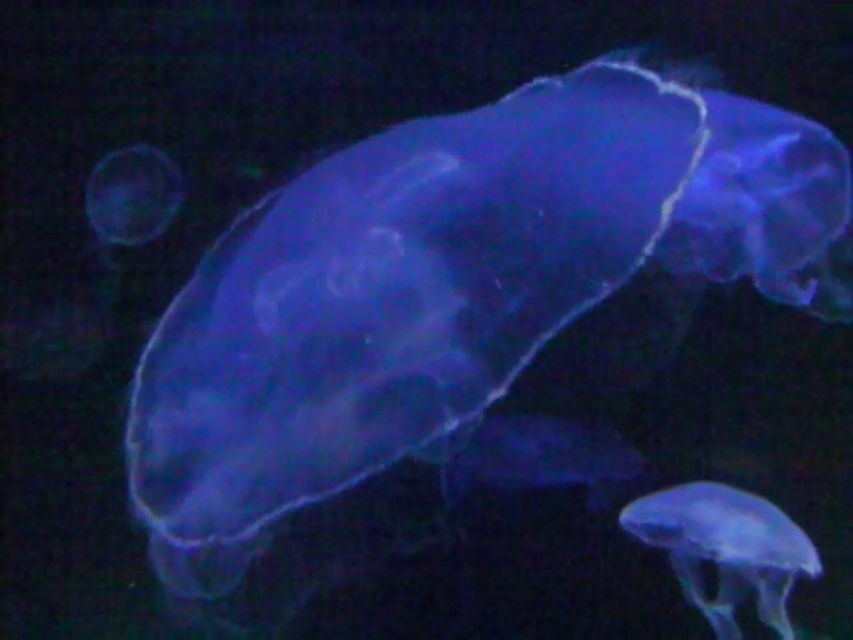
In the scene shown: Who is more distant from viewer, (225, 524) or (115, 218)?

The point (115, 218) is behind.

Is translucent blue jellyfish at center bigger than translucent blue jellyfish at upper left?

Yes, translucent blue jellyfish at center is bigger than translucent blue jellyfish at upper left.

Is point (361, 280) positioned before point (97, 182)?

Yes.

Image resolution: width=853 pixels, height=640 pixels. What are the coordinates of `translucent blue jellyfish at center` in the screenshot? It's located at (392, 301).

Does point (338, 452) come farther from viewer compared to point (694, 577)?

No, it is not.

The width and height of the screenshot is (853, 640). What do you see at coordinates (392, 301) in the screenshot? I see `translucent blue jellyfish at center` at bounding box center [392, 301].

Where is `translucent blue jellyfish at center`? The height and width of the screenshot is (640, 853). translucent blue jellyfish at center is located at coordinates click(x=392, y=301).

Does translucent blue jellyfish at lower right have a greater height compared to translucent blue jellyfish at upper left?

Correct, translucent blue jellyfish at lower right is much taller as translucent blue jellyfish at upper left.

Who is shorter, translucent blue jellyfish at lower right or translucent blue jellyfish at upper left?

With less height is translucent blue jellyfish at upper left.

Identify the location of translucent blue jellyfish at lower right. This screenshot has height=640, width=853. (724, 548).

Identify the location of translucent blue jellyfish at lower right. Image resolution: width=853 pixels, height=640 pixels. (724, 548).